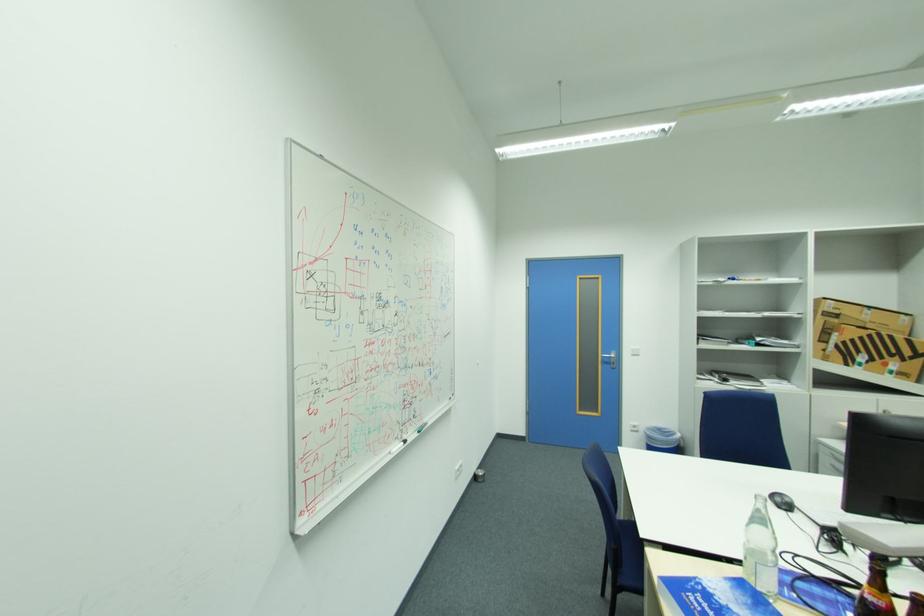
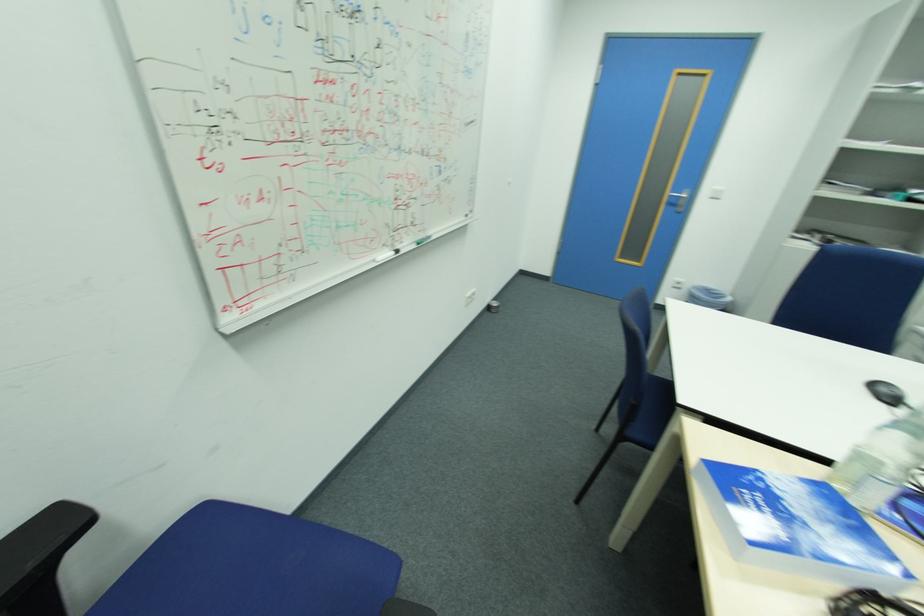
Question: Based on the continuous images, in which direction is the camera rotating? Reply with the corresponding letter.

Choices:
 (A) Left
 (B) Right
 (C) Up
 (D) Down

Answer: (D)